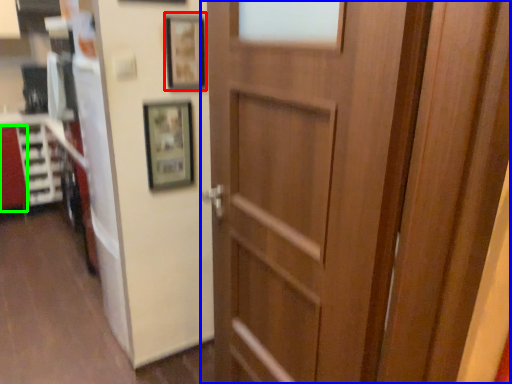
Question: Estimate the real-world distances between objects in this image. Which object is farther from picture frame (highlighted by a red box), door (highlighted by a blue box) or cabinetry (highlighted by a green box)?

Choices:
 (A) door
 (B) cabinetry

Answer: (B)